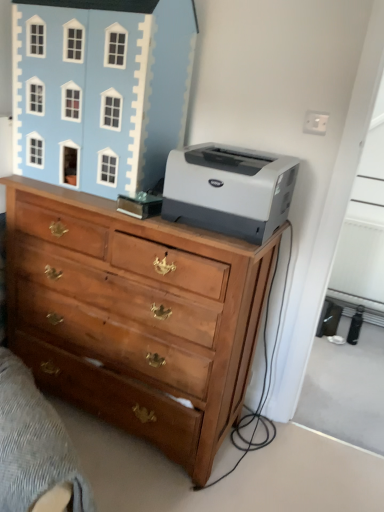
Question: Is wooden chest of drawers at center at the left side of gray matte printer at upper right?

Choices:
 (A) no
 (B) yes

Answer: (B)

Question: Does wooden chest of drawers at center appear on the right side of gray matte printer at upper right?

Choices:
 (A) yes
 (B) no

Answer: (B)

Question: Considering the relative sizes of wooden chest of drawers at center and gray matte printer at upper right in the image provided, is wooden chest of drawers at center taller than gray matte printer at upper right?

Choices:
 (A) no
 (B) yes

Answer: (B)

Question: Are wooden chest of drawers at center and gray matte printer at upper right beside each other?

Choices:
 (A) yes
 (B) no

Answer: (B)

Question: Is wooden chest of drawers at center far away from gray matte printer at upper right?

Choices:
 (A) yes
 (B) no

Answer: (B)

Question: Does wooden chest of drawers at center have a lesser width compared to gray matte printer at upper right?

Choices:
 (A) yes
 (B) no

Answer: (B)

Question: From a real-world perspective, is wooden drawer at lower left located beneath wooden chest of drawers at center?

Choices:
 (A) yes
 (B) no

Answer: (A)

Question: Considering the relative sizes of wooden drawer at lower left and wooden chest of drawers at center in the image provided, is wooden drawer at lower left taller than wooden chest of drawers at center?

Choices:
 (A) no
 (B) yes

Answer: (A)

Question: From a real-world perspective, is wooden drawer at lower left located higher than wooden chest of drawers at center?

Choices:
 (A) no
 (B) yes

Answer: (A)

Question: Is wooden drawer at lower left at the left side of wooden chest of drawers at center?

Choices:
 (A) no
 (B) yes

Answer: (B)

Question: Considering the relative sizes of wooden drawer at lower left and wooden chest of drawers at center in the image provided, is wooden drawer at lower left shorter than wooden chest of drawers at center?

Choices:
 (A) no
 (B) yes

Answer: (B)

Question: Considering the relative sizes of wooden drawer at lower left and wooden chest of drawers at center in the image provided, is wooden drawer at lower left bigger than wooden chest of drawers at center?

Choices:
 (A) yes
 (B) no

Answer: (B)

Question: Is light blue painted wood dollhouse at upper left completely or partially outside of wooden chest of drawers at center?

Choices:
 (A) no
 (B) yes

Answer: (B)